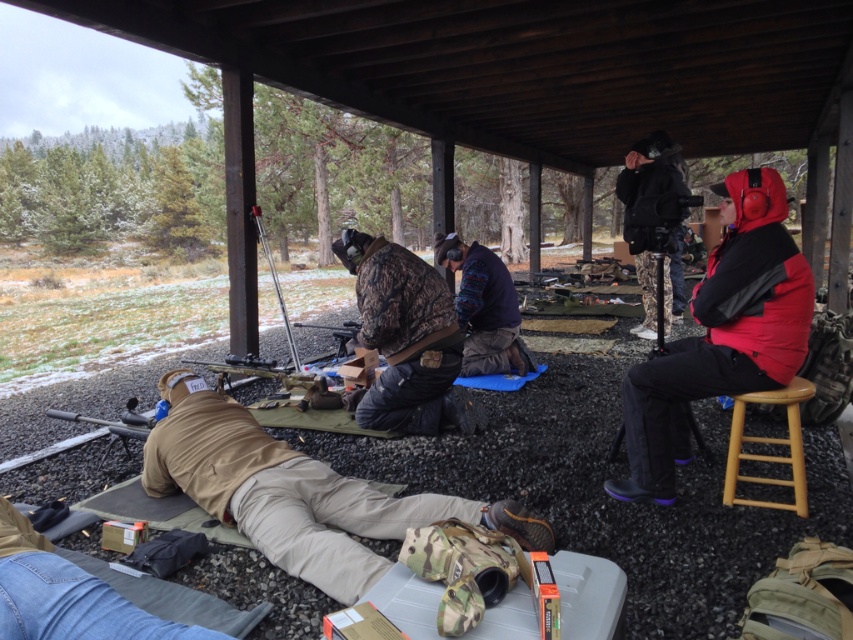
How far apart are tan fabric pants at lower left and knitted sweater at center?

tan fabric pants at lower left and knitted sweater at center are 6.64 feet apart.

Is point (318, 557) more distant than point (515, 332)?

That is False.

Identify the location of tan fabric pants at lower left. (294, 492).

Is camouflage fabric jacket at center bigger than light brown wooden stool at right?

Indeed, camouflage fabric jacket at center has a larger size compared to light brown wooden stool at right.

Who is shorter, camouflage fabric jacket at center or light brown wooden stool at right?

Standing shorter between the two is light brown wooden stool at right.

Which is behind, point (358, 248) or point (769, 442)?

Positioned behind is point (358, 248).

Locate an element on the screen. The image size is (853, 640). camouflage fabric jacket at center is located at coordinates (402, 333).

Between tan fabric pants at lower left and light brown wooden stool at right, which one is positioned lower?

tan fabric pants at lower left is lower down.

Does tan fabric pants at lower left appear over light brown wooden stool at right?

Incorrect, tan fabric pants at lower left is not positioned above light brown wooden stool at right.

At what (x,y) coordinates should I click in order to perform the action: click on tan fabric pants at lower left. Please return your answer as a coordinate pair (x, y). Image resolution: width=853 pixels, height=640 pixels. Looking at the image, I should click on click(x=294, y=492).